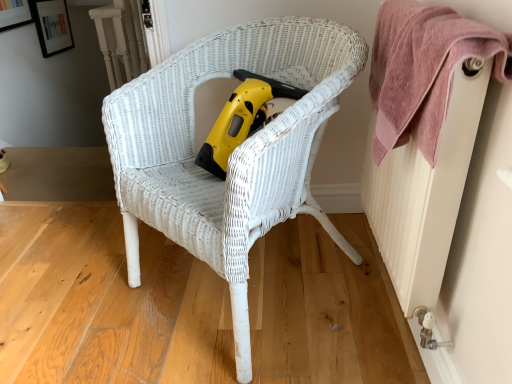
Locate an element on the screen. This screenshot has width=512, height=384. vacant area to the left of white wicker chair at center is located at coordinates (85, 291).